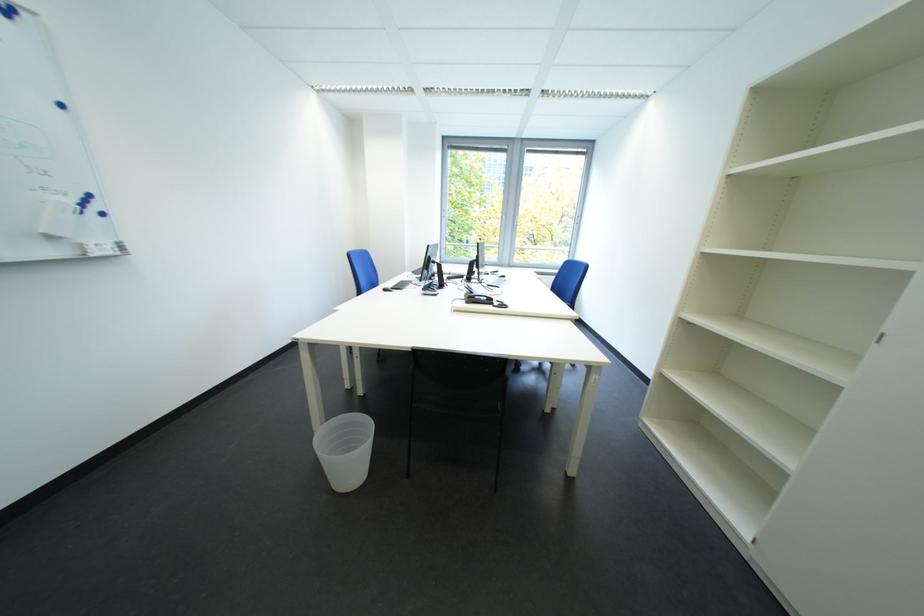
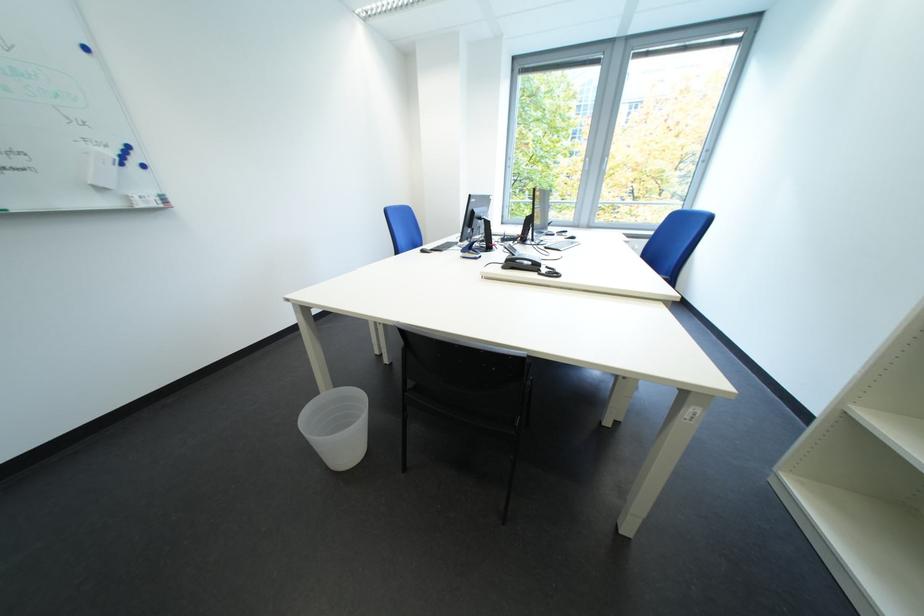
Question: I am providing you with two images of the same scene from different viewpoints. Which of the following objects are not visible in image2?

Choices:
 (A) white plastic trashcan
 (B) black telephone handset
 (C) blue magnet
 (D) none of these

Answer: (D)